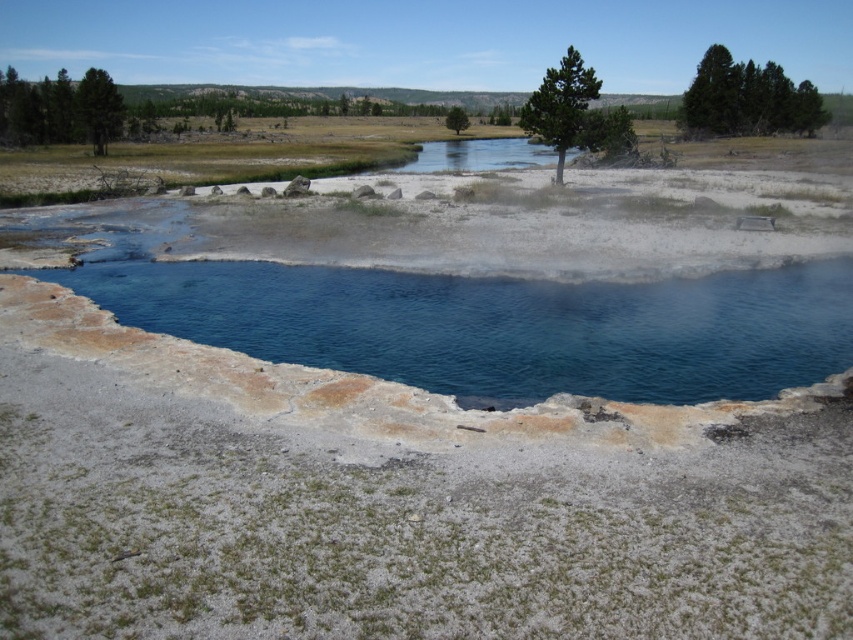
You are a photographer planning to capture the geothermal pool and the surrounding landscape. Given that the blue clear water at center and the green leafy tree at center are both in your frame, which object takes up more space in the image?

The green leafy tree at center occupies more space in the image than the blue clear water at center.

Looking at this image, you are standing at the edge of the geothermal pool in the image. There is a point marked at coordinates (x=497, y=324). What is located at that point?

The point at coordinates (x=497, y=324) indicates blue clear water at center.